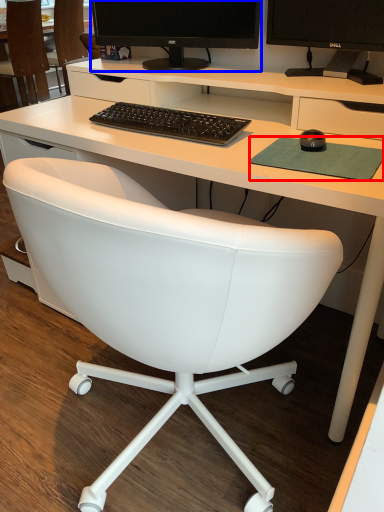
Question: Among these objects, which one is nearest to the camera, mousepad (highlighted by a red box) or computer monitor (highlighted by a blue box)?

Choices:
 (A) mousepad
 (B) computer monitor

Answer: (A)